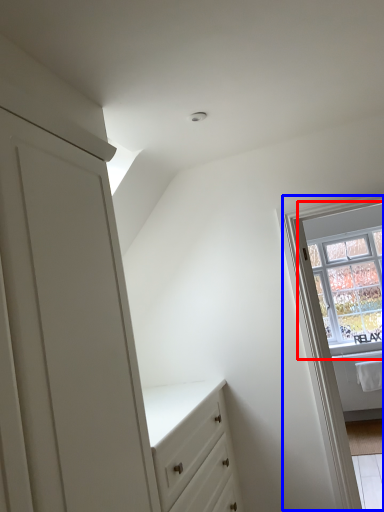
Question: Which of the following is the closest to the observer, window (highlighted by a red box) or window frame (highlighted by a blue box)?

Choices:
 (A) window
 (B) window frame

Answer: (B)